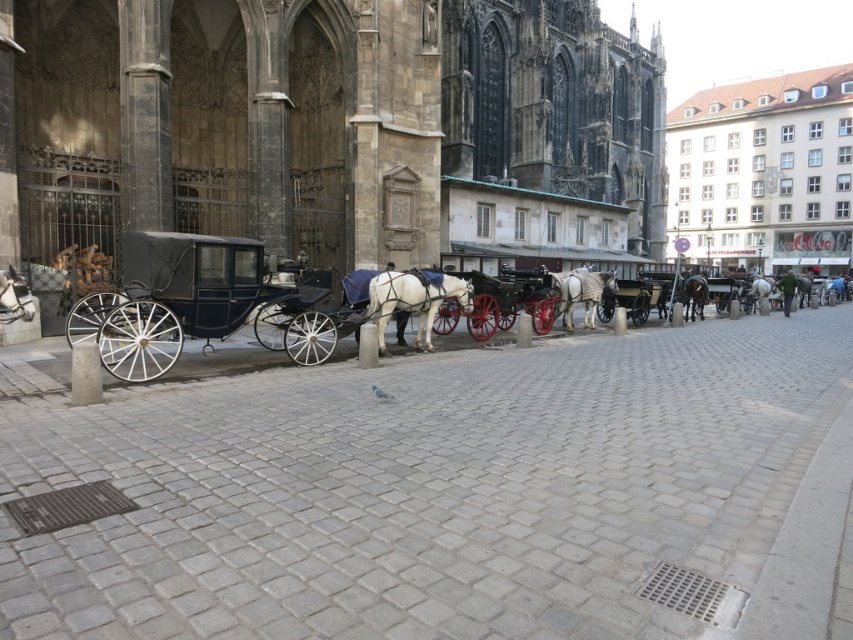
From the picture: Is white glossy cart at center positioned behind white matte horse at center?

No, white glossy cart at center is in front of white matte horse at center.

Is white glossy cart at center smaller than white matte horse at center?

Yes, white glossy cart at center is smaller than white matte horse at center.

The image size is (853, 640). I want to click on white glossy cart at center, so click(498, 304).

Locate an element on the screen. This screenshot has height=640, width=853. white glossy cart at center is located at coordinates (498, 304).

Does white matte horse at center appear on the left side of white glossy horse at left?

In fact, white matte horse at center is to the right of white glossy horse at left.

Between point (589, 285) and point (9, 268), which one is positioned in front?

Point (9, 268) is more forward.

Between point (585, 324) and point (4, 301), which one is positioned behind?

The point (585, 324) is more distant.

Where is `white matte horse at center`? white matte horse at center is located at coordinates (582, 292).

From the picture: Does white glossy cart at center have a greater height compared to shiny brown horse at center?

Correct, white glossy cart at center is much taller as shiny brown horse at center.

Is white glossy cart at center above shiny brown horse at center?

Actually, white glossy cart at center is below shiny brown horse at center.

This screenshot has width=853, height=640. What do you see at coordinates (498, 304) in the screenshot? I see `white glossy cart at center` at bounding box center [498, 304].

This screenshot has width=853, height=640. I want to click on white glossy cart at center, so click(x=498, y=304).